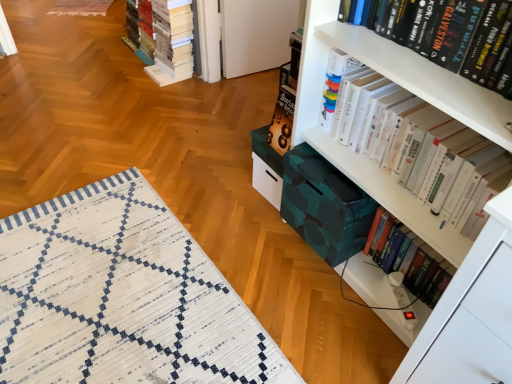
In order to click on free space to the left of white paper book at upper left, the 1th book positioned from the left in this screenshot , I will do `click(82, 63)`.